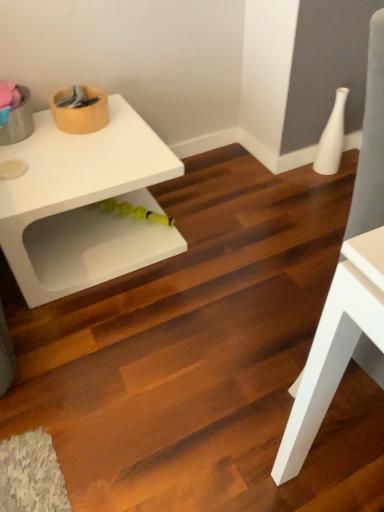
Question: Is there a large distance between white glossy vase at upper right and white matte table at upper left, positioned as the 1th table in back-to-front order?

Choices:
 (A) no
 (B) yes

Answer: (B)

Question: Can you confirm if white glossy vase at upper right is wider than white matte table at upper left, the second table when ordered from front to back?

Choices:
 (A) yes
 (B) no

Answer: (B)

Question: Is white glossy vase at upper right aimed at white matte table at upper left, which is the 1th table in left-to-right order?

Choices:
 (A) no
 (B) yes

Answer: (B)

Question: From the image's perspective, is white glossy vase at upper right over white matte table at upper left, which is the 1th table in left-to-right order?

Choices:
 (A) yes
 (B) no

Answer: (A)

Question: Is the position of white glossy vase at upper right more distant than that of white matte table at upper left, the second table when ordered from front to back?

Choices:
 (A) yes
 (B) no

Answer: (A)

Question: Does white glossy vase at upper right have a larger size compared to white matte table at upper left, which is the second table from right to left?

Choices:
 (A) no
 (B) yes

Answer: (A)

Question: Is white matte table at upper left, positioned as the 1th table in back-to-front order, to the right of white glossy vase at upper right from the viewer's perspective?

Choices:
 (A) no
 (B) yes

Answer: (A)

Question: Is white matte table at upper left, the second table when ordered from front to back, positioned far away from white glossy vase at upper right?

Choices:
 (A) no
 (B) yes

Answer: (B)

Question: Considering the relative positions of white matte table at upper left, positioned as the 1th table in back-to-front order, and white glossy vase at upper right in the image provided, is white matte table at upper left, positioned as the 1th table in back-to-front order, to the left of white glossy vase at upper right from the viewer's perspective?

Choices:
 (A) no
 (B) yes

Answer: (B)

Question: Considering the relative sizes of white matte table at upper left, the second table when ordered from front to back, and white glossy vase at upper right in the image provided, is white matte table at upper left, the second table when ordered from front to back, wider than white glossy vase at upper right?

Choices:
 (A) no
 (B) yes

Answer: (B)

Question: Is white glossy vase at upper right inside white matte table at upper left, the second table when ordered from front to back?

Choices:
 (A) yes
 (B) no

Answer: (B)

Question: Considering the relative sizes of white matte table at upper left, positioned as the 1th table in back-to-front order, and white glossy vase at upper right in the image provided, is white matte table at upper left, positioned as the 1th table in back-to-front order, smaller than white glossy vase at upper right?

Choices:
 (A) no
 (B) yes

Answer: (A)

Question: Could white matte table at right, which is counted as the second table, starting from the left, be considered to be inside white matte table at upper left, the second table when ordered from front to back?

Choices:
 (A) no
 (B) yes

Answer: (A)